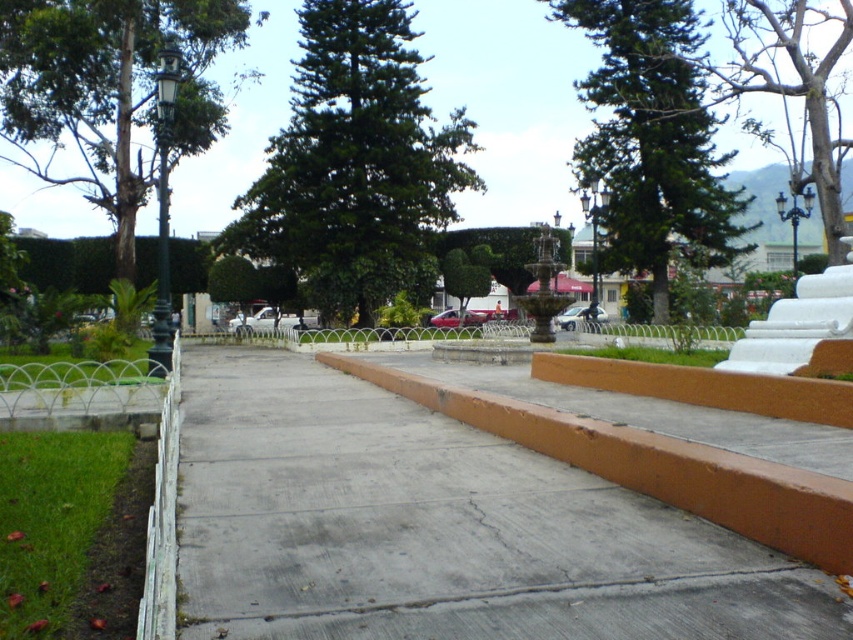
Is gray concrete at center below bare wood tree at upper right?

Correct, gray concrete at center is located below bare wood tree at upper right.

Is point (223, 586) positioned behind point (822, 131)?

No, it is in front of (822, 131).

You are a GUI agent. You are given a task and a screenshot of the screen. Output one action in this format:
    pyautogui.click(x=<x>, y=<y>)
    Task: Click on the gray concrete at center
    
    Given the screenshot: What is the action you would take?
    pyautogui.click(x=439, y=529)

Looking at this image, does green textured tree at left appear under green textured tree at center?

Correct, green textured tree at left is located below green textured tree at center.

Does green textured tree at left appear over green textured tree at center?

No.

Find the location of a particular element. Image resolution: width=853 pixels, height=640 pixels. green textured tree at left is located at coordinates (109, 92).

Find the location of a particular element. Image resolution: width=853 pixels, height=640 pixels. green textured tree at left is located at coordinates (109, 92).

Does green textured tree at left have a lesser width compared to bare wood tree at upper right?

No.

Looking at this image, who is more forward, (15, 134) or (848, 140)?

Point (848, 140) is in front.

Between point (50, 20) and point (780, 148), which one is positioned in front?

Point (50, 20) is in front.

Where is `green textured tree at left`? green textured tree at left is located at coordinates (109, 92).